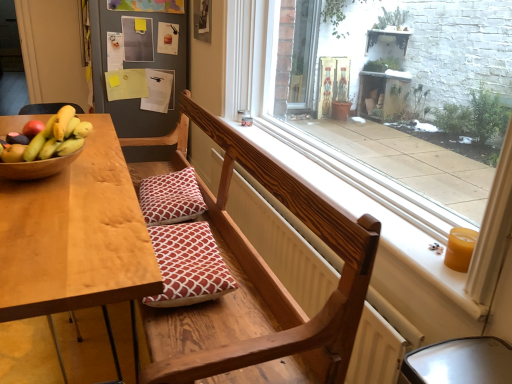
Question: From the image's perspective, is transparent glass window at center over wooden bench at center?

Choices:
 (A) yes
 (B) no

Answer: (A)

Question: Is transparent glass window at center shorter than wooden bench at center?

Choices:
 (A) yes
 (B) no

Answer: (A)

Question: Would you say transparent glass window at center is a long distance from wooden bench at center?

Choices:
 (A) no
 (B) yes

Answer: (A)

Question: Does transparent glass window at center come in front of wooden bench at center?

Choices:
 (A) no
 (B) yes

Answer: (A)

Question: Considering the relative positions of transparent glass window at center and wooden bench at center in the image provided, is transparent glass window at center behind wooden bench at center?

Choices:
 (A) no
 (B) yes

Answer: (B)

Question: Is red printed cushion at center, which is counted as the first pillow, starting from the back, taller or shorter than wooden bench at center?

Choices:
 (A) tall
 (B) short

Answer: (B)

Question: From a real-world perspective, relative to wooden bench at center, is red printed cushion at center, which is the 2th pillow in bottom-to-top order, vertically above or below?

Choices:
 (A) above
 (B) below

Answer: (A)

Question: Considering the positions of point (173, 188) and point (266, 332), is point (173, 188) closer or farther from the camera than point (266, 332)?

Choices:
 (A) farther
 (B) closer

Answer: (A)

Question: From the image's perspective, relative to wooden bench at center, is red printed cushion at center, which appears as the first pillow when viewed from the top, above or below?

Choices:
 (A) below
 (B) above

Answer: (B)

Question: Do you think transparent glass window at center is within shiny yellow bananas at table left, or outside of it?

Choices:
 (A) outside
 (B) inside

Answer: (A)

Question: From a real-world perspective, is transparent glass window at center physically located above or below shiny yellow bananas at table left?

Choices:
 (A) above
 (B) below

Answer: (A)

Question: In terms of height, does transparent glass window at center look taller or shorter compared to shiny yellow bananas at table left?

Choices:
 (A) tall
 (B) short

Answer: (A)

Question: From the image's perspective, relative to shiny yellow bananas at table left, is transparent glass window at center above or below?

Choices:
 (A) above
 (B) below

Answer: (A)

Question: Looking at the image, does yellow wax candle at right seem bigger or smaller compared to wooden bench at center?

Choices:
 (A) small
 (B) big

Answer: (A)

Question: Considering the positions of point (462, 269) and point (147, 344), is point (462, 269) closer or farther from the camera than point (147, 344)?

Choices:
 (A) closer
 (B) farther

Answer: (A)